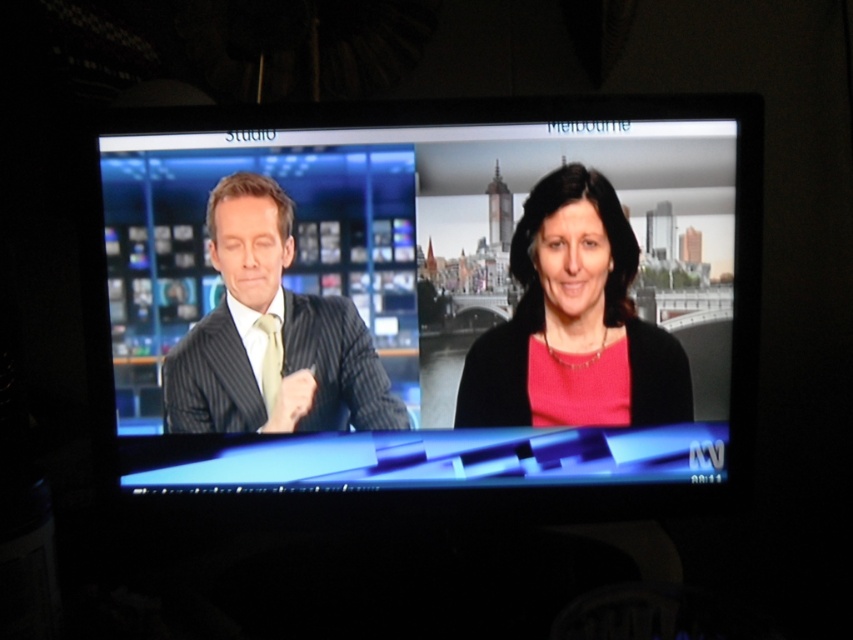
Question: Does matte black suit at center appear over pink matte/black sweater at center?

Choices:
 (A) yes
 (B) no

Answer: (B)

Question: Is the position of matte black suit at center less distant than that of pinstriped suit at left?

Choices:
 (A) yes
 (B) no

Answer: (A)

Question: Which point is closer to the camera?

Choices:
 (A) (202, 330)
 (B) (160, 381)

Answer: (A)

Question: Among these objects, which one is nearest to the camera?

Choices:
 (A) pink matte/black sweater at center
 (B) matte black suit at center

Answer: (B)

Question: Which is nearer to the matte black suit at center?

Choices:
 (A) pinstriped suit at left
 (B) pink matte/black sweater at center

Answer: (B)

Question: Can you confirm if pink matte/black sweater at center is positioned below pinstriped suit at left?

Choices:
 (A) no
 (B) yes

Answer: (A)